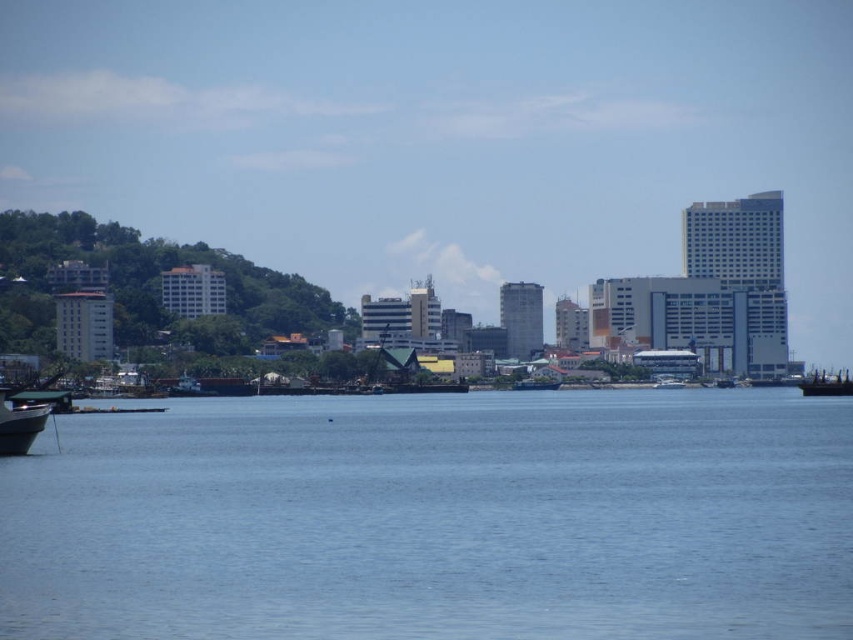
Question: Considering the relative positions of metallic gray boat at center and white glossy boat at center in the image provided, where is metallic gray boat at center located with respect to white glossy boat at center?

Choices:
 (A) below
 (B) above

Answer: (A)

Question: From the image, what is the correct spatial relationship of metallic gray boat at center in relation to white glossy boat at center?

Choices:
 (A) below
 (B) above

Answer: (A)

Question: Estimate the real-world distances between objects in this image. Which object is closer to the metallic gray boat at center?

Choices:
 (A) blue water at center
 (B) metallic gray boat at right
 (C) white glossy boat at center
 (D) metallic gray boat at lower left

Answer: (C)

Question: Which point appears closest to the camera in this image?

Choices:
 (A) (584, 577)
 (B) (0, 412)
 (C) (660, 381)
 (D) (553, 378)

Answer: (A)

Question: Can you confirm if blue water at center is bigger than white glossy boat at center?

Choices:
 (A) yes
 (B) no

Answer: (A)

Question: Estimate the real-world distances between objects in this image. Which object is farther from the blue water at center?

Choices:
 (A) metallic gray boat at center
 (B) metallic gray boat at right
 (C) metallic gray boat at lower left
 (D) white glossy boat at center

Answer: (B)